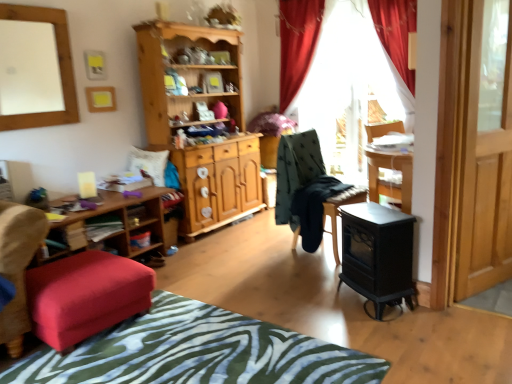
Question: Should I look upward or downward to see white matte mirror at upper left?

Choices:
 (A) up
 (B) down

Answer: (A)

Question: From a real-world perspective, is black matte wood stove at lower right physically below transparent glass door at right?

Choices:
 (A) yes
 (B) no

Answer: (A)

Question: From the image's perspective, would you say black matte wood stove at lower right is positioned over transparent glass door at right?

Choices:
 (A) yes
 (B) no

Answer: (B)

Question: Is black matte wood stove at lower right at the left side of transparent glass door at right?

Choices:
 (A) yes
 (B) no

Answer: (A)

Question: Is black matte wood stove at lower right wider than transparent glass door at right?

Choices:
 (A) yes
 (B) no

Answer: (A)

Question: Would you consider black matte wood stove at lower right to be distant from transparent glass door at right?

Choices:
 (A) yes
 (B) no

Answer: (B)

Question: Does black matte wood stove at lower right have a smaller size compared to transparent glass door at right?

Choices:
 (A) no
 (B) yes

Answer: (B)

Question: From a real-world perspective, is black matte wood stove at lower right positioned over zebra print fabric at lower center based on gravity?

Choices:
 (A) yes
 (B) no

Answer: (A)

Question: Can we say black matte wood stove at lower right lies outside zebra print fabric at lower center?

Choices:
 (A) yes
 (B) no

Answer: (A)

Question: Is black matte wood stove at lower right at the left side of zebra print fabric at lower center?

Choices:
 (A) yes
 (B) no

Answer: (B)

Question: Is zebra print fabric at lower center at the back of black matte wood stove at lower right?

Choices:
 (A) yes
 (B) no

Answer: (B)

Question: Considering the relative sizes of black matte wood stove at lower right and zebra print fabric at lower center in the image provided, is black matte wood stove at lower right taller than zebra print fabric at lower center?

Choices:
 (A) no
 (B) yes

Answer: (B)

Question: Are black matte wood stove at lower right and zebra print fabric at lower center far apart?

Choices:
 (A) no
 (B) yes

Answer: (A)

Question: Could you tell me if red velvet curtain at upper center is turned towards zebra print fabric at lower center?

Choices:
 (A) no
 (B) yes

Answer: (B)